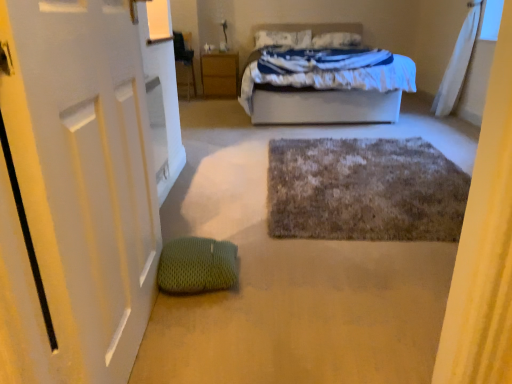
I want to click on vacant region in front of green textured bean bag at lower left, so click(200, 319).